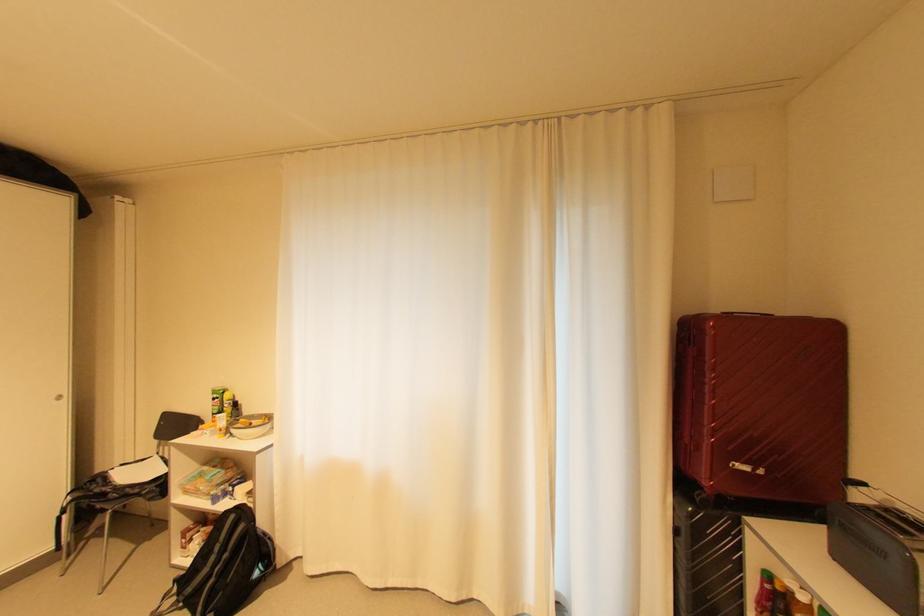
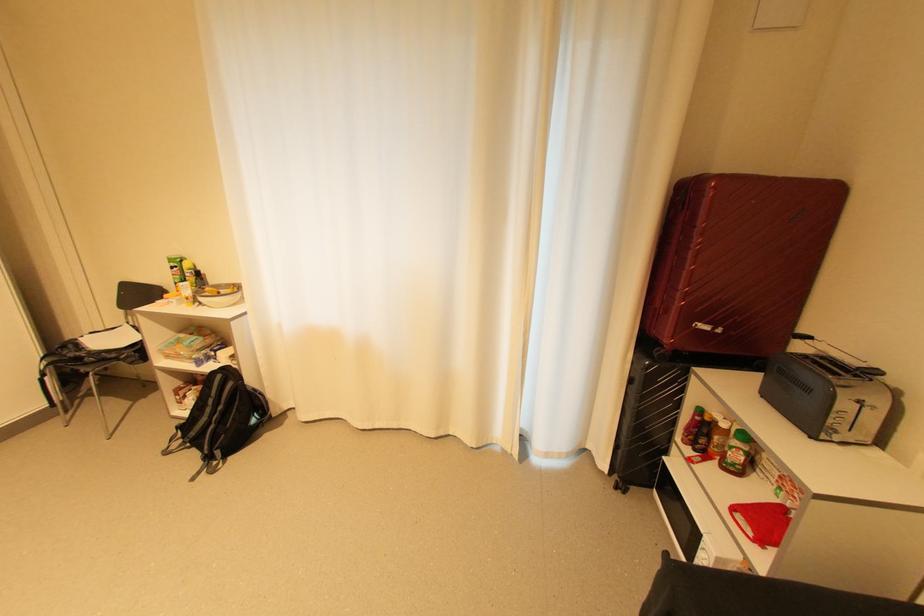
The point at (222, 415) is marked in the first image. Where is the corresponding point in the second image?

(185, 284)